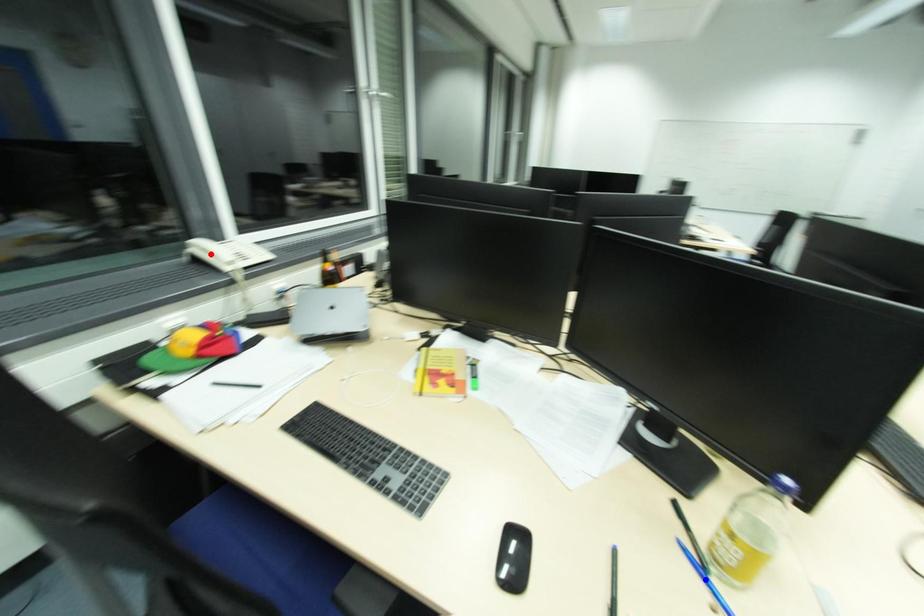
Question: Two points are marked on the image. Which point is closer to the camera?

Choices:
 (A) Blue point is closer.
 (B) Red point is closer.

Answer: (A)